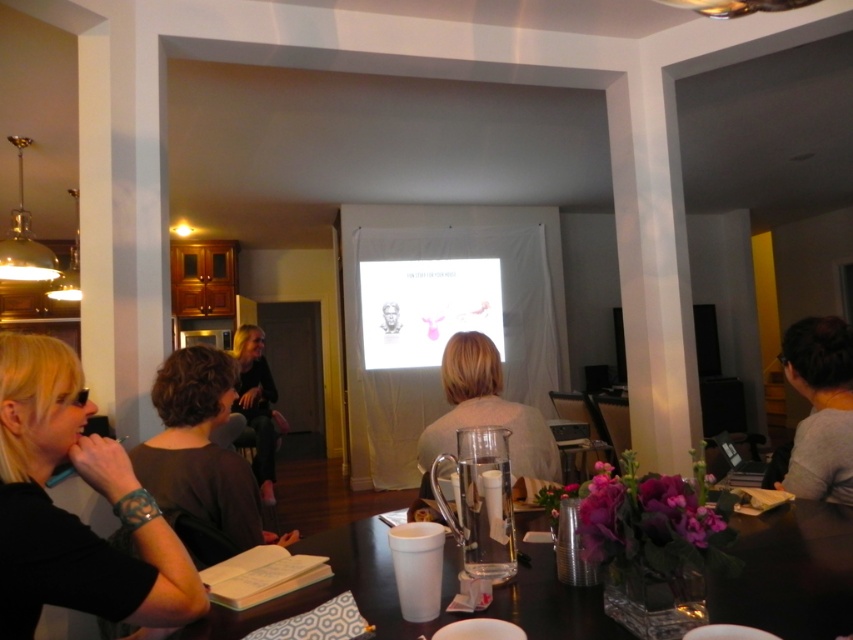
In the scene shown: You are a photographer taking a picture of the scene. You notice the dark brown hair at lower left and the black fabric jacket at center. Which object is positioned higher in the image?

The dark brown hair at lower left is positioned higher than the black fabric jacket at center in the image.

You are a photographer positioned to the right of the scene. You want to take a photo that includes both the dark brown hair at lower left and the light beige sweater at center. Which object should you adjust your camera angle to include first?

The dark brown hair at lower left is to the left of the light beige sweater at center, so you should adjust your camera angle to include the dark brown hair at lower left first since it is positioned further left and might be out of frame if not adjusted for.